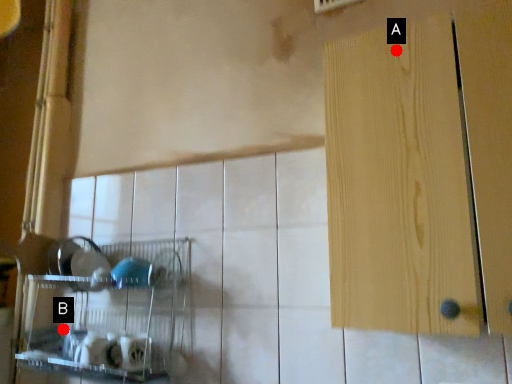
Question: Two points are circled on the image, labeled by A and B beside each circle. Which point is closer to the camera taking this photo?

Choices:
 (A) A is closer
 (B) B is closer

Answer: (A)